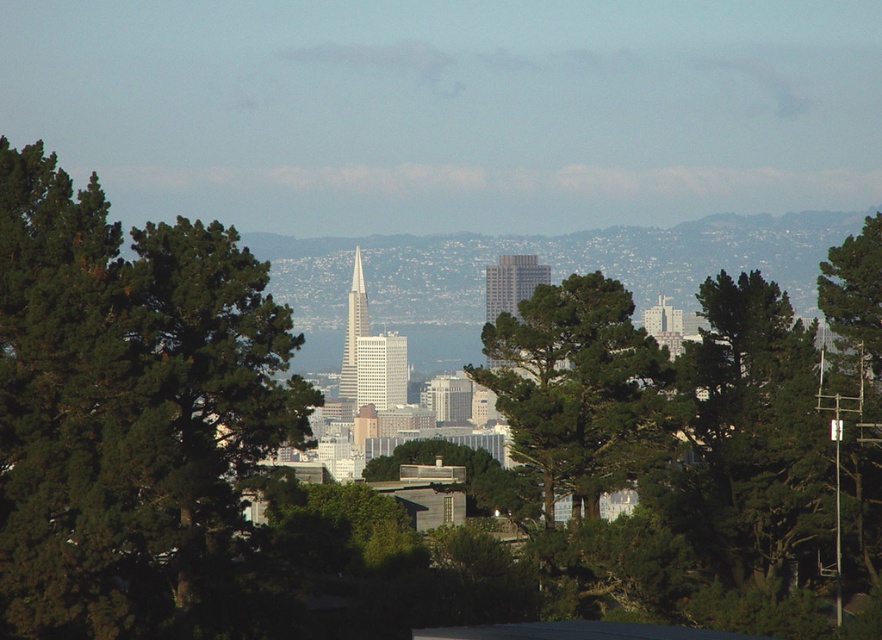
Looking at this image, you are standing at the point marked as point (126, 410) in the cityscape image. What is the nearest object to you?

The nearest object to you at point (126, 410) is the green leafy tree at left.

You are a drone operator trying to capture a photo of the green leafy tree at center from a safe altitude. The drone can only fly up to 400 meters high. Considering the distance between you and the tree, will the drone be able to capture the photo without exceeding its maximum flight altitude?

The distance between the green leafy tree at center and the camera is 649.52 meters. Since the drone can only fly up to 400 meters high, it cannot reach the required altitude to capture the photo without exceeding its limit.